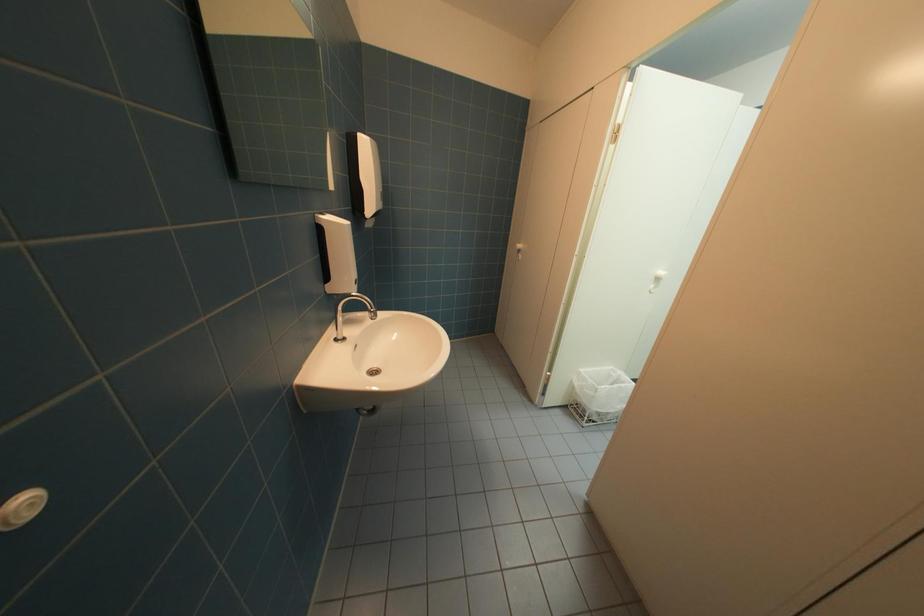
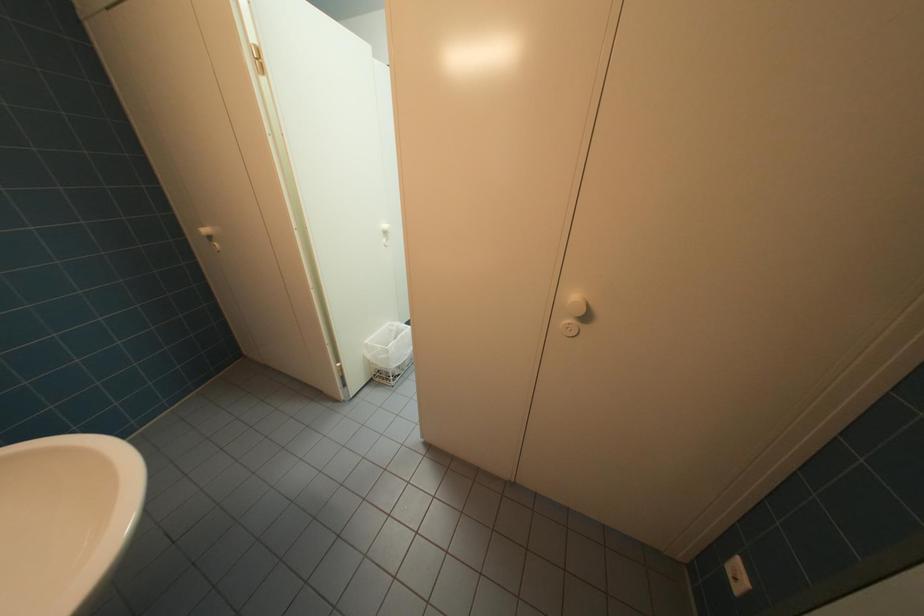
First-person continuous shooting, in which direction is the camera rotating?

The camera's rotation is toward right-down.